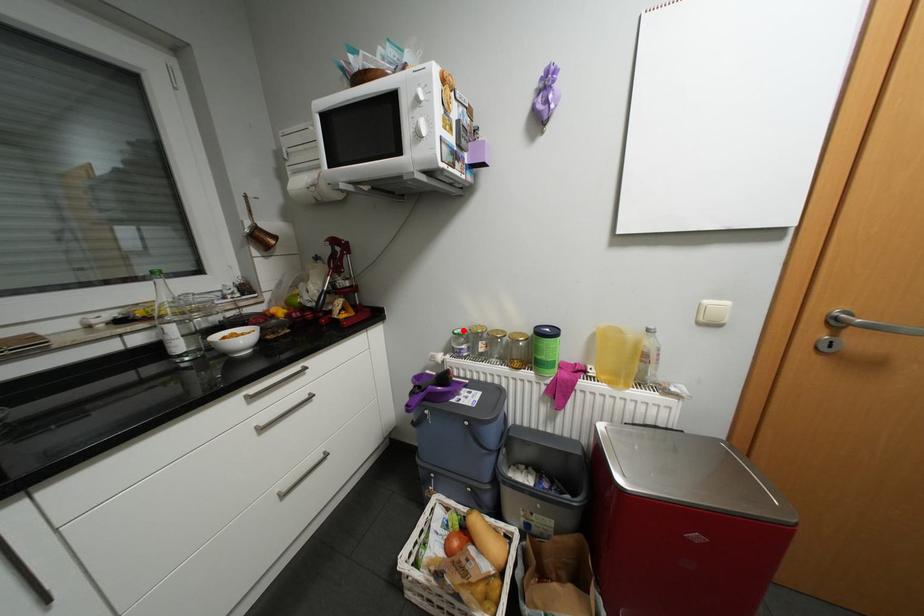
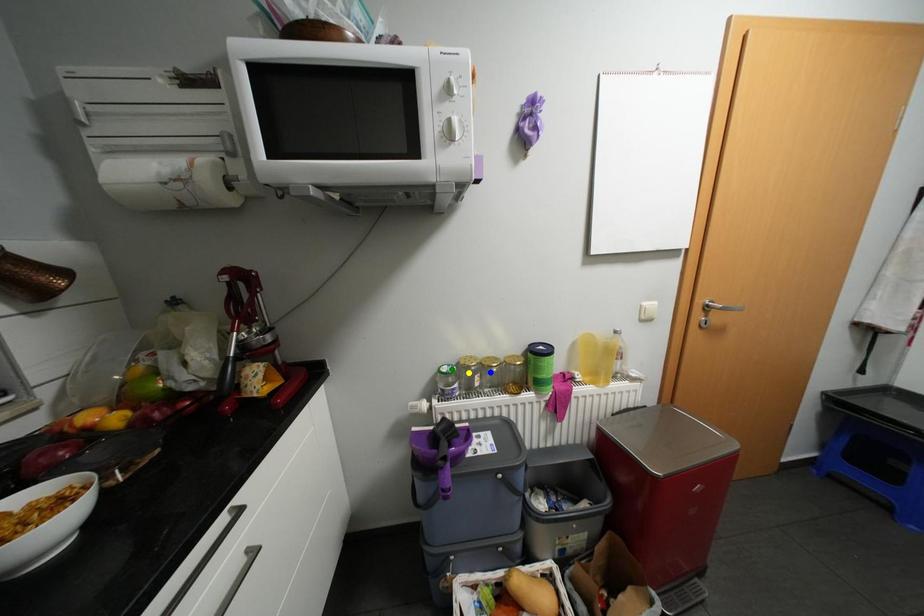
Question: I am providing you with two images of the same scene from different viewpoints. A red point is marked on the first image. You are given multiple points on the second image. Which spot in image 2 lines up with the point in image 1?

Choices:
 (A) green point
 (B) yellow point
 (C) blue point

Answer: (A)